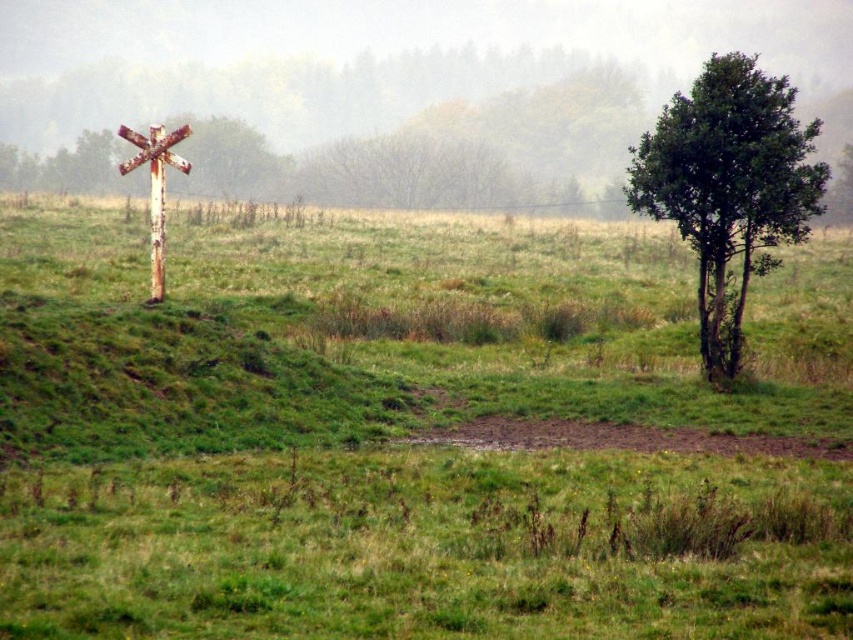
You are a gardener planning to mow the green grassy at left and trim the green leafy tree at right. Based on their sizes, which area will require more time and effort?

The green grassy at left might be wider than the green leafy tree at right, so it may require more time and effort to mow and trim compared to the tree.

You are a photographer positioned at the center of the scene. You want to capture a photo where the green grassy at left and the rusty metal telegraph pole at left are both clearly visible. Based on their positions, which object will appear closer to the camera in the photo?

The green grassy at left will appear closer to the camera because it is positioned in front of the rusty metal telegraph pole at left.